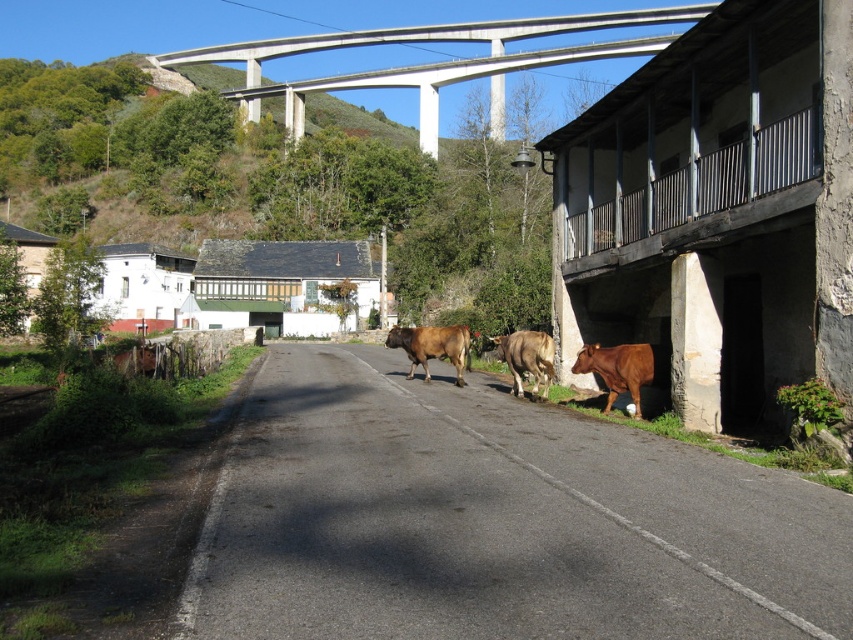
Is the position of concrete at upper center less distant than that of brown glossy bull at center?

No.

Which is behind, point (428, 145) or point (525, 333)?

Positioned behind is point (428, 145).

You are a GUI agent. You are given a task and a screenshot of the screen. Output one action in this format:
    pyautogui.click(x=<x>, y=<y>)
    Task: Click on the concrete at upper center
    This screenshot has height=640, width=853.
    Given the screenshot: What is the action you would take?
    pyautogui.click(x=433, y=61)

Who is positioned more to the right, concrete at upper center or brown matte bull at center?

From the viewer's perspective, concrete at upper center appears more on the right side.

Is concrete at upper center shorter than brown matte bull at center?

No, concrete at upper center is not shorter than brown matte bull at center.

Based on the photo, who is more forward, (498, 65) or (398, 339)?

Point (398, 339) is more forward.

This screenshot has width=853, height=640. I want to click on concrete at upper center, so click(x=433, y=61).

Measure the distance from brown matte bull at center to brown glossy bull at center.

brown matte bull at center and brown glossy bull at center are 6.16 meters apart.

Is brown matte bull at center positioned before brown glossy bull at center?

No.

Identify the location of brown matte bull at center. The image size is (853, 640). (432, 346).